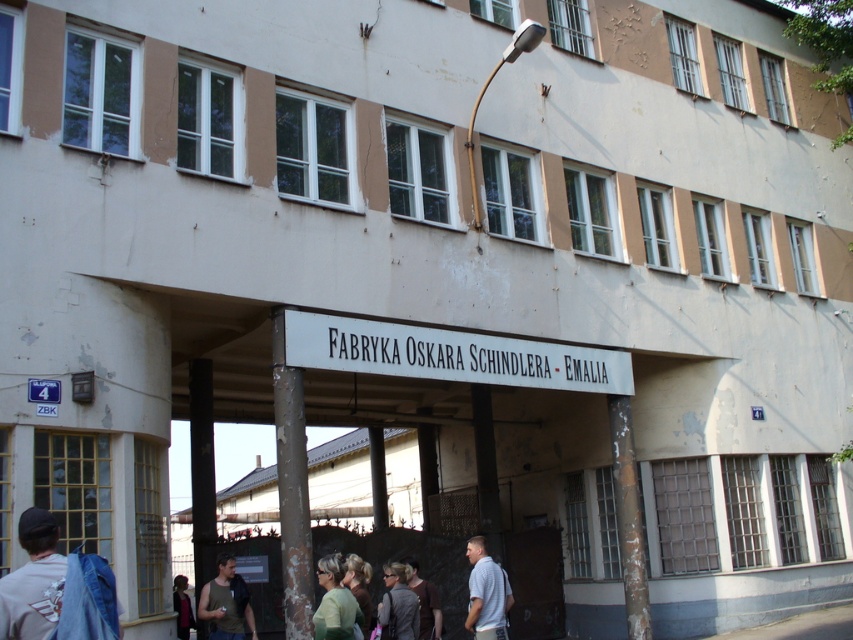
Is matte black tank top at lower left positioned in front of dark brown leather jacket at lower left?

Yes, matte black tank top at lower left is in front of dark brown leather jacket at lower left.

What do you see at coordinates (225, 602) in the screenshot?
I see `matte black tank top at lower left` at bounding box center [225, 602].

This screenshot has height=640, width=853. Find the location of `matte black tank top at lower left`. matte black tank top at lower left is located at coordinates (225, 602).

Which is above, gray fabric jacket at lower center or brown matte shirt at center?

gray fabric jacket at lower center

Does gray fabric jacket at lower center have a lesser height compared to brown matte shirt at center?

Yes.

This screenshot has height=640, width=853. Describe the element at coordinates (397, 604) in the screenshot. I see `gray fabric jacket at lower center` at that location.

Locate an element on the screen. Image resolution: width=853 pixels, height=640 pixels. gray fabric jacket at lower center is located at coordinates (397, 604).

Can you confirm if brown matte door at center is positioned to the right of gray fabric jacket at lower center?

Yes, brown matte door at center is to the right of gray fabric jacket at lower center.

Can you confirm if brown matte door at center is positioned below gray fabric jacket at lower center?

Yes, brown matte door at center is below gray fabric jacket at lower center.

Which is in front, point (503, 545) or point (387, 616)?

Positioned in front is point (387, 616).

Where is `brown matte door at center`? The width and height of the screenshot is (853, 640). brown matte door at center is located at coordinates (535, 582).